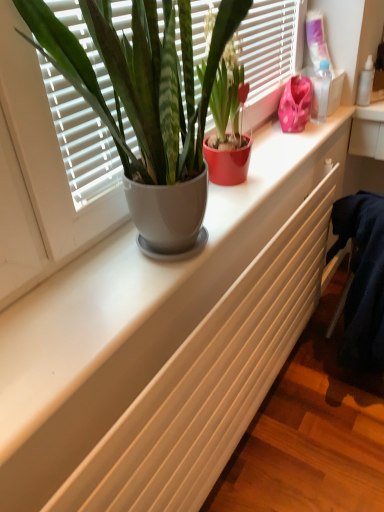
I want to click on free location in front of matte ceramic pot at center, the second houseplant when ordered from left to right, so click(x=230, y=209).